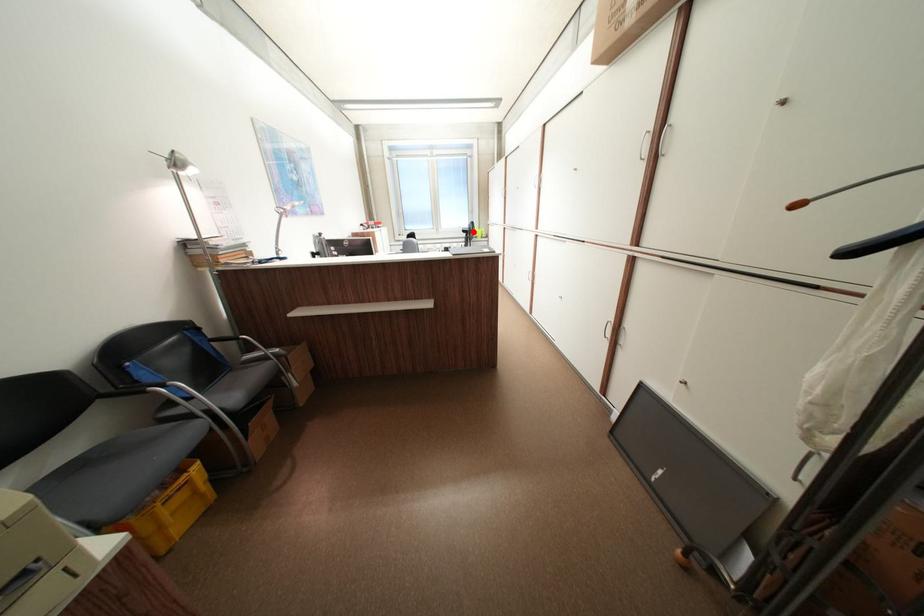
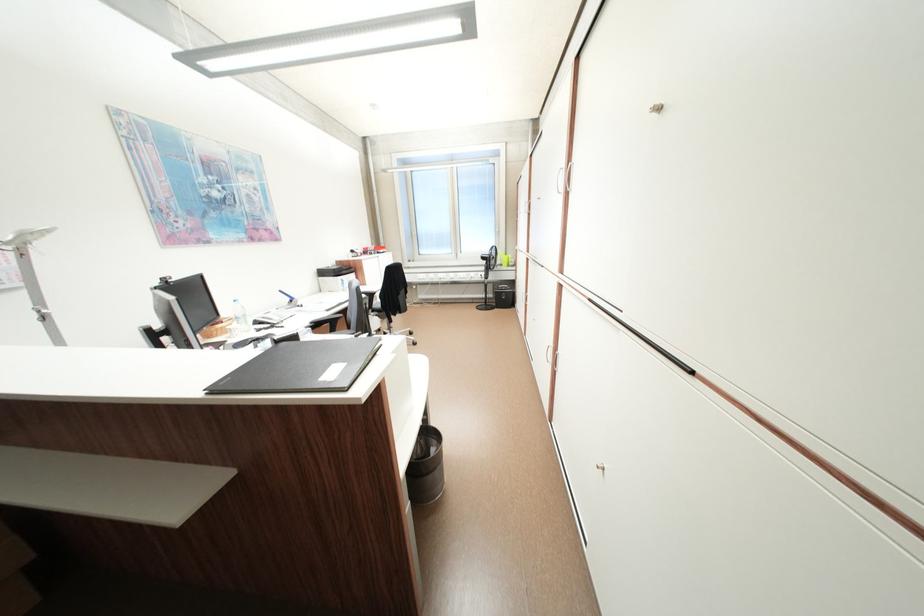
Locate, in the second image, the point that corresponds to the highlighted location in the first image.

(492, 259)